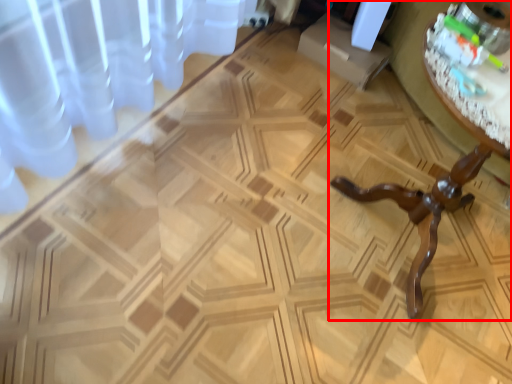
Question: Where is table (annotated by the red box) located in relation to round table in the image?

Choices:
 (A) left
 (B) right

Answer: (B)